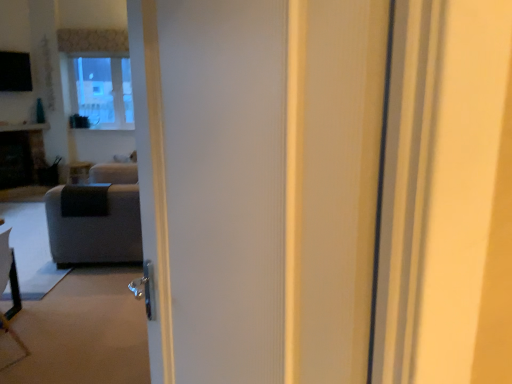
Where is `dark gray stone fireplace at left`? Image resolution: width=512 pixels, height=384 pixels. dark gray stone fireplace at left is located at coordinates 21,154.

Based on the photo, what is the approximate width of dark gray stone fireplace at left?

23.46 inches.

Locate an element on the screen. This screenshot has width=512, height=384. matte black side table at center is located at coordinates (79, 172).

Is point (69, 261) in front of point (72, 174)?

Yes, point (69, 261) is in front of point (72, 174).

Could you tell me if gray fabric couch at left is turned towards matte black side table at center?

No, gray fabric couch at left does not turn towards matte black side table at center.

Can you see gray fabric couch at left touching matte black side table at center?

No.

Is gray fabric couch at left taller than matte black side table at center?

Yes.

Is gray fabric couch at left to the right of dark gray stone fireplace at left from the viewer's perspective?

Correct, you'll find gray fabric couch at left to the right of dark gray stone fireplace at left.

Looking at this image, can dark gray stone fireplace at left be found inside gray fabric couch at left?

Actually, dark gray stone fireplace at left is outside gray fabric couch at left.

From a real-world perspective, is gray fabric couch at left physically above dark gray stone fireplace at left?

Actually, gray fabric couch at left is physically below dark gray stone fireplace at left in the real world.

Is gray fabric couch at left facing towards dark gray stone fireplace at left?

No, gray fabric couch at left does not turn towards dark gray stone fireplace at left.

From a real-world perspective, is dark gray stone fireplace at left located beneath gray fabric couch at left?

Actually, dark gray stone fireplace at left is physically above gray fabric couch at left in the real world.

Which is in front, dark gray stone fireplace at left or gray fabric couch at left?

gray fabric couch at left is closer to the camera.

Is gray fabric couch at left not close to transparent glass window at upper left?

gray fabric couch at left is positioned a significant distance from transparent glass window at upper left.

Is point (67, 193) less distant than point (106, 123)?

Yes, it is in front of point (106, 123).

Can you confirm if gray fabric couch at left is wider than transparent glass window at upper left?

Yes.

Does gray fabric couch at left have a larger size compared to transparent glass window at upper left?

Yes.

Is matte black side table at center directly adjacent to gray fabric couch at left?

No, matte black side table at center is not in contact with gray fabric couch at left.

Considering the sizes of matte black side table at center and gray fabric couch at left in the image, is matte black side table at center taller or shorter than gray fabric couch at left?

Considering their sizes, matte black side table at center has less height than gray fabric couch at left.

In the scene shown: Is matte black side table at center behind gray fabric couch at left?

Yes, it is behind gray fabric couch at left.

Between matte black side table at center and gray fabric couch at left, which one has larger width?

gray fabric couch at left is wider.

From a real-world perspective, is matte black side table at center below transparent glass window at upper left?

Yes, from a real-world perspective, matte black side table at center is under transparent glass window at upper left.

Does matte black side table at center have a lesser height compared to transparent glass window at upper left?

Yes.

From the image's perspective, which object appears higher, matte black side table at center or transparent glass window at upper left?

transparent glass window at upper left.

Identify the location of side table lying below the transparent glass window at upper left (from the image's perspective). The width and height of the screenshot is (512, 384). (79, 172).

Can you confirm if matte black side table at center is positioned to the left of dark gray stone fireplace at left?

No.

From the image's perspective, which one is positioned lower, matte black side table at center or dark gray stone fireplace at left?

matte black side table at center.

Where is `fireplace on the left of the matte black side table at center`? The width and height of the screenshot is (512, 384). fireplace on the left of the matte black side table at center is located at coordinates (21, 154).

Is matte black side table at center inside or outside of dark gray stone fireplace at left?

matte black side table at center is outside dark gray stone fireplace at left.

In the image, there is a gray fabric couch at left. Where is `side table below it (from a real-world perspective)`? side table below it (from a real-world perspective) is located at coordinates (79, 172).

I want to click on fireplace behind the gray fabric couch at left, so point(21,154).

Looking at the image, which one is located further to dark gray stone fireplace at left, matte black side table at center or gray fabric couch at left?

gray fabric couch at left is further to dark gray stone fireplace at left.

When comparing their distances from dark gray stone fireplace at left, does transparent glass window at upper left or gray fabric couch at left seem further?

The object further to dark gray stone fireplace at left is gray fabric couch at left.

Based on their spatial positions, is dark gray stone fireplace at left or gray fabric couch at left further from transparent glass window at upper left?

The object further to transparent glass window at upper left is gray fabric couch at left.

Based on the photo, based on their spatial positions, is transparent glass window at upper left or gray fabric couch at left closer to matte black side table at center?

transparent glass window at upper left is closer to matte black side table at center.

Considering their positions, is transparent glass window at upper left positioned closer to gray fabric couch at left than dark gray stone fireplace at left?

dark gray stone fireplace at left is positioned closer to the anchor gray fabric couch at left.

Looking at the image, which one is located closer to gray fabric couch at left, matte black side table at center or transparent glass window at upper left?

The object closer to gray fabric couch at left is matte black side table at center.

From the image, which object appears to be nearer to dark gray stone fireplace at left, transparent glass window at upper left or matte black side table at center?

The object closer to dark gray stone fireplace at left is matte black side table at center.

Considering their positions, is dark gray stone fireplace at left positioned further to matte black side table at center than gray fabric couch at left?

Based on the image, gray fabric couch at left appears to be further to matte black side table at center.

I want to click on window located between gray fabric couch at left and matte black side table at center in the depth direction, so click(x=99, y=76).

Identify the location of fireplace positioned between gray fabric couch at left and matte black side table at center from near to far. (21, 154).

At what (x,y) coordinates should I click in order to perform the action: click on fireplace between gray fabric couch at left and transparent glass window at upper left from front to back. Please return your answer as a coordinate pair (x, y). This screenshot has height=384, width=512. Looking at the image, I should click on (21, 154).

Locate an element on the screen. side table located between dark gray stone fireplace at left and transparent glass window at upper left in the left-right direction is located at coordinates (79, 172).